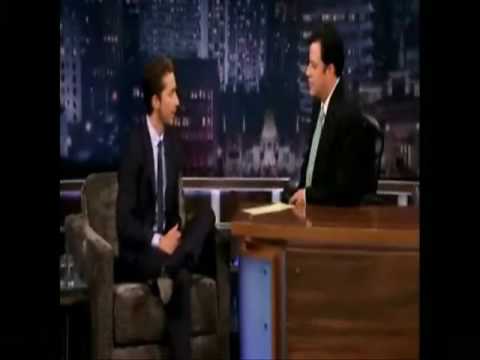
The width and height of the screenshot is (480, 360). I want to click on arms of shair, so click(x=88, y=252), click(x=219, y=244).